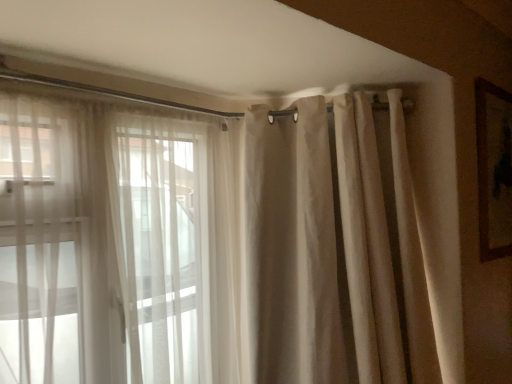
Question: Does sheer white curtains at left lie behind brown wooden picture frame at upper right?

Choices:
 (A) yes
 (B) no

Answer: (B)

Question: From the image's perspective, is sheer white curtains at left under brown wooden picture frame at upper right?

Choices:
 (A) no
 (B) yes

Answer: (B)

Question: Does sheer white curtains at left have a larger size compared to brown wooden picture frame at upper right?

Choices:
 (A) yes
 (B) no

Answer: (A)

Question: Are sheer white curtains at left and brown wooden picture frame at upper right making contact?

Choices:
 (A) no
 (B) yes

Answer: (A)

Question: Are sheer white curtains at left and brown wooden picture frame at upper right located far from each other?

Choices:
 (A) yes
 (B) no

Answer: (A)

Question: From their relative heights in the image, would you say brown wooden picture frame at upper right is taller or shorter than beige fabric curtain at upper right?

Choices:
 (A) short
 (B) tall

Answer: (A)

Question: From a real-world perspective, is brown wooden picture frame at upper right physically located above or below beige fabric curtain at upper right?

Choices:
 (A) below
 (B) above

Answer: (B)

Question: Does point 507,205 appear closer or farther from the camera than point 266,205?

Choices:
 (A) farther
 (B) closer

Answer: (A)

Question: Is brown wooden picture frame at upper right bigger or smaller than beige fabric curtain at upper right?

Choices:
 (A) small
 (B) big

Answer: (A)

Question: Looking at their shapes, would you say beige fabric curtain at upper right is wider or thinner than sheer white curtains at left?

Choices:
 (A) thin
 (B) wide

Answer: (B)

Question: Is point (345, 215) closer or farther from the camera than point (31, 172)?

Choices:
 (A) farther
 (B) closer

Answer: (A)

Question: Which is correct: beige fabric curtain at upper right is inside sheer white curtains at left, or outside of it?

Choices:
 (A) inside
 (B) outside

Answer: (B)

Question: From the image's perspective, relative to sheer white curtains at left, is beige fabric curtain at upper right above or below?

Choices:
 (A) below
 (B) above

Answer: (B)

Question: From the image's perspective, is sheer white curtains at left located above or below brown wooden picture frame at upper right?

Choices:
 (A) above
 (B) below

Answer: (B)

Question: Considering the relative positions of sheer white curtains at left and brown wooden picture frame at upper right in the image provided, is sheer white curtains at left to the left or to the right of brown wooden picture frame at upper right?

Choices:
 (A) right
 (B) left

Answer: (B)